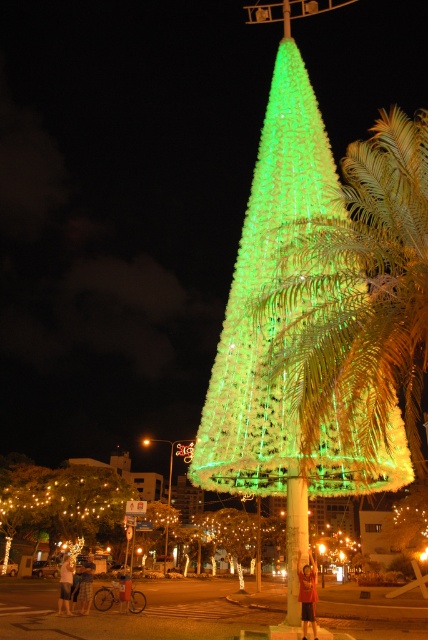
Who is positioned more to the right, green illuminated cone at center or light brown shorts at lower left?

green illuminated cone at center

In the scene shown: Is green illuminated cone at center bigger than light brown shorts at lower left?

Correct, green illuminated cone at center is larger in size than light brown shorts at lower left.

The image size is (428, 640). What do you see at coordinates (240, 532) in the screenshot? I see `green illuminated cone at center` at bounding box center [240, 532].

At what (x,y) coordinates should I click in order to perform the action: click on green illuminated cone at center. Please return your answer as a coordinate pair (x, y). This screenshot has height=640, width=428. Looking at the image, I should click on (240, 532).

Consider the image. Is green illuminated cone at center to the right of denim shorts at lower left from the viewer's perspective?

Yes, green illuminated cone at center is to the right of denim shorts at lower left.

Which is more to the right, green illuminated cone at center or denim shorts at lower left?

Positioned to the right is green illuminated cone at center.

Between point (213, 561) and point (86, 611), which one is positioned behind?

The point (213, 561) is behind.

Image resolution: width=428 pixels, height=640 pixels. I want to click on green illuminated cone at center, so click(x=240, y=532).

Between point (288, 518) and point (89, 577), which one is positioned in front?

Positioned in front is point (288, 518).

Who is positioned more to the left, green plastic pole at center or denim shorts at lower left?

From the viewer's perspective, denim shorts at lower left appears more on the left side.

Where is `green plastic pole at center`? green plastic pole at center is located at coordinates (296, 544).

Where is `green plastic pole at center`? Image resolution: width=428 pixels, height=640 pixels. green plastic pole at center is located at coordinates (296, 544).